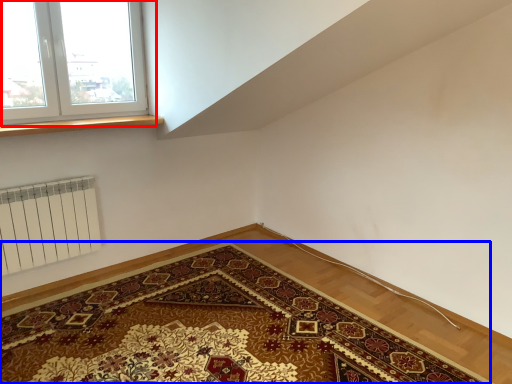
Question: Which object is further to the camera taking this photo, window (highlighted by a red box) or mat (highlighted by a blue box)?

Choices:
 (A) window
 (B) mat

Answer: (A)